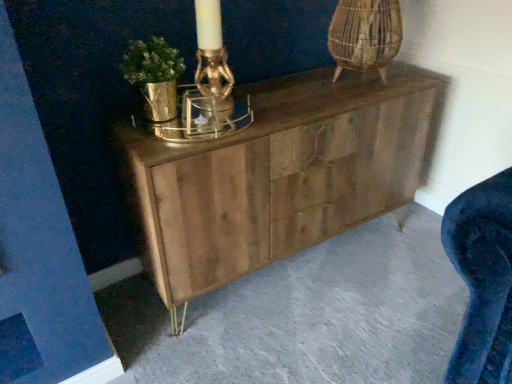
The width and height of the screenshot is (512, 384). Describe the element at coordinates (273, 177) in the screenshot. I see `wooden chest of drawers at center` at that location.

The width and height of the screenshot is (512, 384). In order to click on wooden chest of drawers at center in this screenshot , I will do `click(273, 177)`.

The image size is (512, 384). Identify the location of natural wood cabinet at center. (305, 316).

This screenshot has height=384, width=512. What do you see at coordinates (305, 316) in the screenshot?
I see `natural wood cabinet at center` at bounding box center [305, 316].

Find the location of a particular element. This screenshot has width=512, height=384. wooden chest of drawers at center is located at coordinates (273, 177).

Considering the positions of objects natural wood cabinet at center and wooden chest of drawers at center in the image provided, who is more to the left, natural wood cabinet at center or wooden chest of drawers at center?

From the viewer's perspective, wooden chest of drawers at center appears more on the left side.

In the image, is natural wood cabinet at center positioned in front of or behind wooden chest of drawers at center?

natural wood cabinet at center is in front of wooden chest of drawers at center.

Based on the photo, which point is more distant from viewer, (437,359) or (213,165)?

The point (437,359) is farther.

In the scene shown: From the image's perspective, between natural wood cabinet at center and wooden chest of drawers at center, which one is located above?

wooden chest of drawers at center.

From a real-world perspective, is natural wood cabinet at center on wooden chest of drawers at center?

No.

Which of these two, natural wood cabinet at center or wooden chest of drawers at center, is wider?

natural wood cabinet at center is wider.

Considering the relative sizes of natural wood cabinet at center and wooden chest of drawers at center in the image provided, is natural wood cabinet at center taller than wooden chest of drawers at center?

No.

Between natural wood cabinet at center and wooden chest of drawers at center, which one has smaller size?

Smaller between the two is natural wood cabinet at center.

Is natural wood cabinet at center outside of wooden chest of drawers at center?

Yes.

Does natural wood cabinet at center touch wooden chest of drawers at center?

No, natural wood cabinet at center is not in contact with wooden chest of drawers at center.

Is natural wood cabinet at center facing towards wooden chest of drawers at center?

No.

Can you tell me how much natural wood cabinet at center and wooden chest of drawers at center differ in facing direction?

0.197 degrees separate the facing orientations of natural wood cabinet at center and wooden chest of drawers at center.

The height and width of the screenshot is (384, 512). Identify the location of chest of drawers behind the natural wood cabinet at center. (273, 177).

Is wooden chest of drawers at center to the left or to the right of natural wood cabinet at center in the image?

wooden chest of drawers at center is to the left of natural wood cabinet at center.

Is the position of wooden chest of drawers at center less distant than that of natural wood cabinet at center?

No.

Does point (152, 174) lie in front of point (185, 355)?

Yes.

From the image's perspective, is wooden chest of drawers at center positioned above or below natural wood cabinet at center?

wooden chest of drawers at center is situated higher than natural wood cabinet at center in the image.

From a real-world perspective, is wooden chest of drawers at center physically below natural wood cabinet at center?

No, from a real-world perspective, wooden chest of drawers at center is not below natural wood cabinet at center.

Considering the relative sizes of wooden chest of drawers at center and natural wood cabinet at center in the image provided, is wooden chest of drawers at center wider than natural wood cabinet at center?

No, wooden chest of drawers at center is not wider than natural wood cabinet at center.

Can you confirm if wooden chest of drawers at center is shorter than natural wood cabinet at center?

No, wooden chest of drawers at center is not shorter than natural wood cabinet at center.

Who is smaller, wooden chest of drawers at center or natural wood cabinet at center?

With smaller size is natural wood cabinet at center.

Choose the correct answer: Is wooden chest of drawers at center inside natural wood cabinet at center or outside it?

wooden chest of drawers at center exists outside the volume of natural wood cabinet at center.

Is wooden chest of drawers at center with natural wood cabinet at center?

No, wooden chest of drawers at center is not with natural wood cabinet at center.

Is natural wood cabinet at center at the back of wooden chest of drawers at center?

wooden chest of drawers at center does not have its back to natural wood cabinet at center.

How many degrees apart are the facing directions of wooden chest of drawers at center and natural wood cabinet at center?

0.197 degrees.

You are a GUI agent. You are given a task and a screenshot of the screen. Output one action in this format:
    pyautogui.click(x=<x>, y=<y>)
    Task: Click on the concrete that is under the wooden chest of drawers at center (from a real-world perspective)
    The width and height of the screenshot is (512, 384).
    Given the screenshot: What is the action you would take?
    pyautogui.click(x=305, y=316)

Locate an element on the screen. The width and height of the screenshot is (512, 384). chest of drawers located on the left of natural wood cabinet at center is located at coordinates (273, 177).

The height and width of the screenshot is (384, 512). What are the coordinates of `chest of drawers above the natural wood cabinet at center (from the image's perspective)` in the screenshot? It's located at (273, 177).